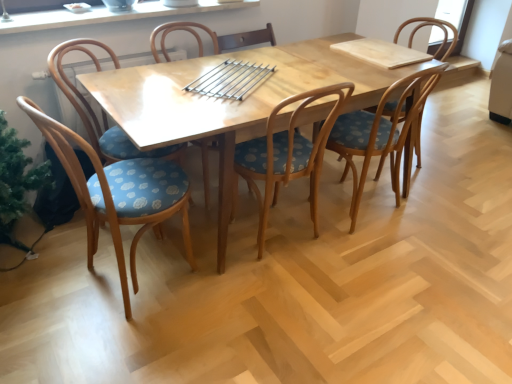
Where is `vacant area that lies to the right of blue polka dot wood chair at left, which is the 2th chair from left to right`? vacant area that lies to the right of blue polka dot wood chair at left, which is the 2th chair from left to right is located at coordinates (231, 290).